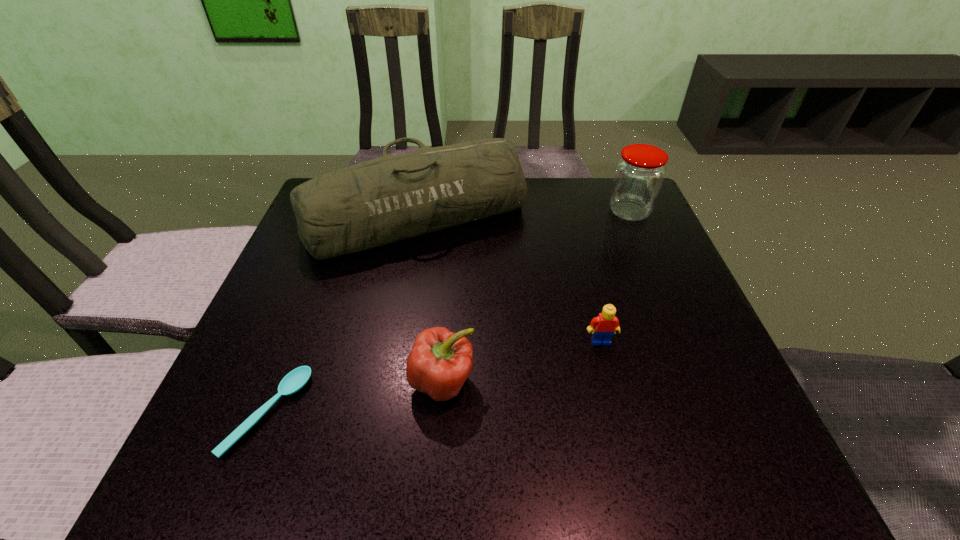
Locate an element on the screen. free area in between the Lego and the third shortest object is located at coordinates (521, 361).

At what (x,y) coordinates should I click in order to perform the action: click on unoccupied position between the rightmost object and the duffel bag. Please return your answer as a coordinate pair (x, y). The height and width of the screenshot is (540, 960). Looking at the image, I should click on [523, 214].

In order to click on empty space that is in between the Lego and the duffel bag in this screenshot , I will do `click(509, 279)`.

At what (x,y) coordinates should I click in order to perform the action: click on unoccupied position between the third tallest object and the spoon. Please return your answer as a coordinate pair (x, y). Looking at the image, I should click on (355, 397).

Find the location of `free space that is in between the duffel bag and the third nearest object`. free space that is in between the duffel bag and the third nearest object is located at coordinates (509, 279).

Locate an element on the screen. This screenshot has height=540, width=960. vacant space in between the duffel bag and the third tallest object is located at coordinates point(429,299).

Identify the location of the closest object to the shortest object. This screenshot has width=960, height=540. (440, 361).

At what (x,y) coordinates should I click in order to perform the action: click on object that can be found as the third closest to the rightmost object. Please return your answer as a coordinate pair (x, y). The image size is (960, 540). Looking at the image, I should click on (440, 361).